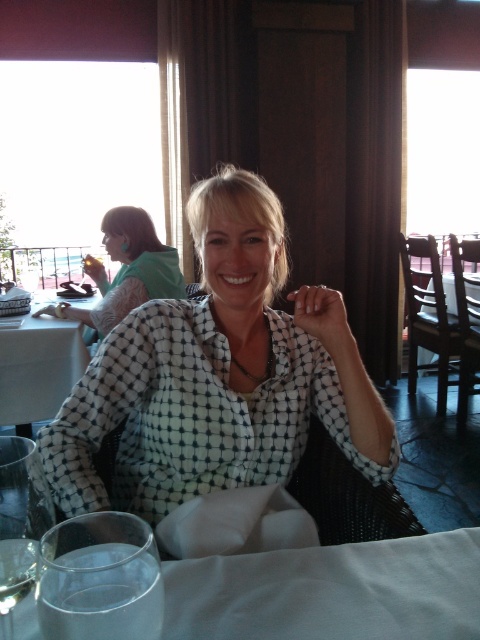
Which is more to the left, white checkered shirt at center or matte black phone at lower left?

From the viewer's perspective, matte black phone at lower left appears more on the left side.

Who is higher up, white checkered shirt at center or matte black phone at lower left?

matte black phone at lower left is higher up.

Find the location of a particular element. Image resolution: width=480 pixels, height=640 pixels. white checkered shirt at center is located at coordinates (218, 376).

The height and width of the screenshot is (640, 480). In order to click on white checkered shirt at center in this screenshot , I will do `click(218, 376)`.

Can you confirm if transparent glass at lower left is taller than matte green plate at upper left?

Correct, transparent glass at lower left is much taller as matte green plate at upper left.

Who is more forward, [117,621] or [99,264]?

Point [117,621]

Does point (63, 634) come behind point (86, 264)?

No.

Locate an element on the screen. The image size is (480, 640). transparent glass at lower left is located at coordinates (99, 579).

Between point (22, 477) and point (99, 264), which one is positioned behind?

Point (99, 264)

Is point (0, 566) positioned in front of point (92, 266)?

Yes, point (0, 566) is closer to viewer.

This screenshot has width=480, height=640. What are the coordinates of `clear glass wine glass at lower left` in the screenshot? It's located at (20, 522).